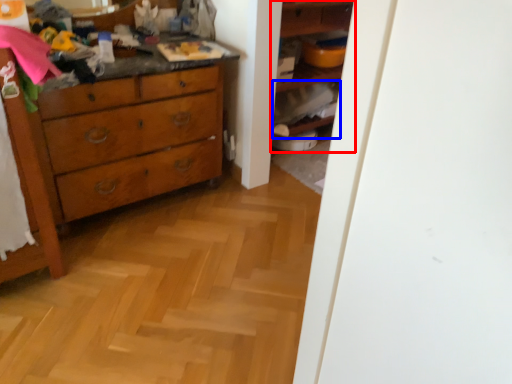
Question: Which object is closer to the camera taking this photo, shelf (highlighted by a red box) or cabinet (highlighted by a blue box)?

Choices:
 (A) shelf
 (B) cabinet

Answer: (A)